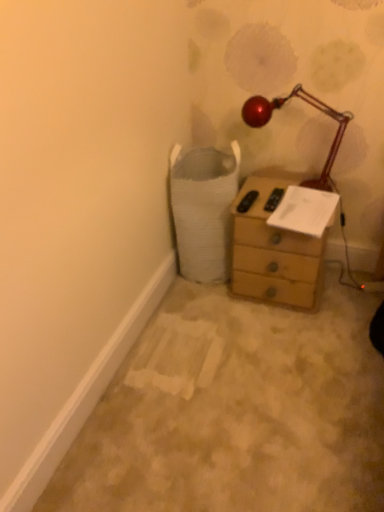
Identify the location of vacant area situated to the left side of wooden chest of drawers at center. (201, 314).